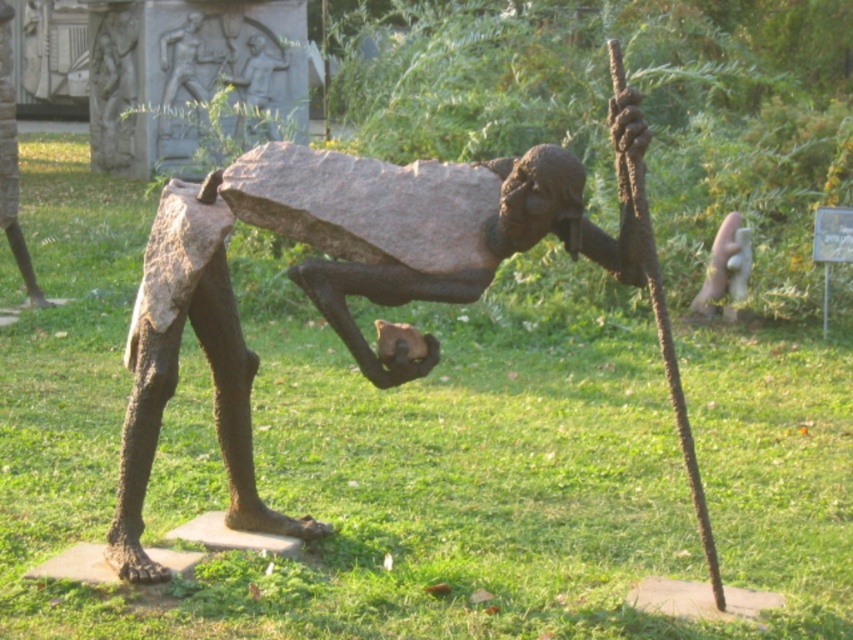
Does bronze statue at left have a greater height compared to bronze relief figure at upper center?

Correct, bronze statue at left is much taller as bronze relief figure at upper center.

Between point (15, 192) and point (201, 102), which one is positioned behind?

The point (201, 102) is behind.

Image resolution: width=853 pixels, height=640 pixels. I want to click on bronze statue at left, so click(12, 164).

Does point (12, 129) lie behind point (256, 74)?

No, it is in front of (256, 74).

Is bronze statue at left thinner than bronze statue at upper center?

Indeed, bronze statue at left has a lesser width compared to bronze statue at upper center.

Where is `bronze statue at left`? This screenshot has height=640, width=853. bronze statue at left is located at coordinates (12, 164).

What are the coordinates of `bronze statue at left` in the screenshot? It's located at (12, 164).

Which is in front, point (184, 29) or point (248, 138)?

Point (248, 138) is in front.

Between bronze relief figure at upper center and bronze statue at upper center, which one has more height?

bronze relief figure at upper center is taller.

You are a GUI agent. You are given a task and a screenshot of the screen. Output one action in this format:
    pyautogui.click(x=<x>, y=<y>)
    Task: Click on the bronze relief figure at upper center
    Image resolution: width=853 pixels, height=640 pixels.
    Given the screenshot: What is the action you would take?
    pyautogui.click(x=184, y=60)

Locate an element on the screen. This screenshot has width=853, height=640. bronze relief figure at upper center is located at coordinates (184, 60).